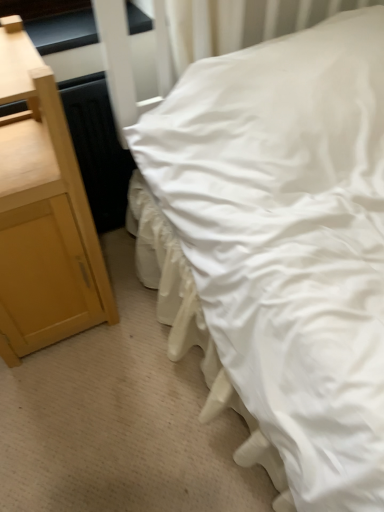
Question: Is white smooth bed at center taller than light wood/texture nightstand at left?

Choices:
 (A) yes
 (B) no

Answer: (A)

Question: Can you confirm if white smooth bed at center is wider than light wood/texture nightstand at left?

Choices:
 (A) no
 (B) yes

Answer: (B)

Question: Is white smooth bed at center in contact with light wood/texture nightstand at left?

Choices:
 (A) yes
 (B) no

Answer: (B)

Question: Is white smooth bed at center further to camera compared to light wood/texture nightstand at left?

Choices:
 (A) no
 (B) yes

Answer: (A)

Question: Considering the relative positions of white smooth bed at center and light wood/texture nightstand at left in the image provided, is white smooth bed at center to the left of light wood/texture nightstand at left from the viewer's perspective?

Choices:
 (A) no
 (B) yes

Answer: (A)

Question: Is black glossy window sill at upper left taller or shorter than white smooth bed at center?

Choices:
 (A) tall
 (B) short

Answer: (B)

Question: From the image's perspective, is black glossy window sill at upper left positioned above or below white smooth bed at center?

Choices:
 (A) above
 (B) below

Answer: (A)

Question: Would you say black glossy window sill at upper left is to the left or to the right of white smooth bed at center in the picture?

Choices:
 (A) right
 (B) left

Answer: (B)

Question: Is black glossy window sill at upper left inside the boundaries of white smooth bed at center, or outside?

Choices:
 (A) inside
 (B) outside

Answer: (B)

Question: From the image's perspective, is white smooth bed at center above or below light wood/texture nightstand at left?

Choices:
 (A) above
 (B) below

Answer: (A)

Question: Is white smooth bed at center in front of or behind light wood/texture nightstand at left in the image?

Choices:
 (A) front
 (B) behind

Answer: (A)

Question: In terms of height, does white smooth bed at center look taller or shorter compared to light wood/texture nightstand at left?

Choices:
 (A) tall
 (B) short

Answer: (A)

Question: Would you say white smooth bed at center is to the left or to the right of light wood/texture nightstand at left in the picture?

Choices:
 (A) left
 (B) right

Answer: (B)

Question: Considering the positions of white smooth bed at center and black glossy window sill at upper left in the image, is white smooth bed at center bigger or smaller than black glossy window sill at upper left?

Choices:
 (A) small
 (B) big

Answer: (B)

Question: From the image's perspective, is white smooth bed at center located above or below black glossy window sill at upper left?

Choices:
 (A) below
 (B) above

Answer: (A)